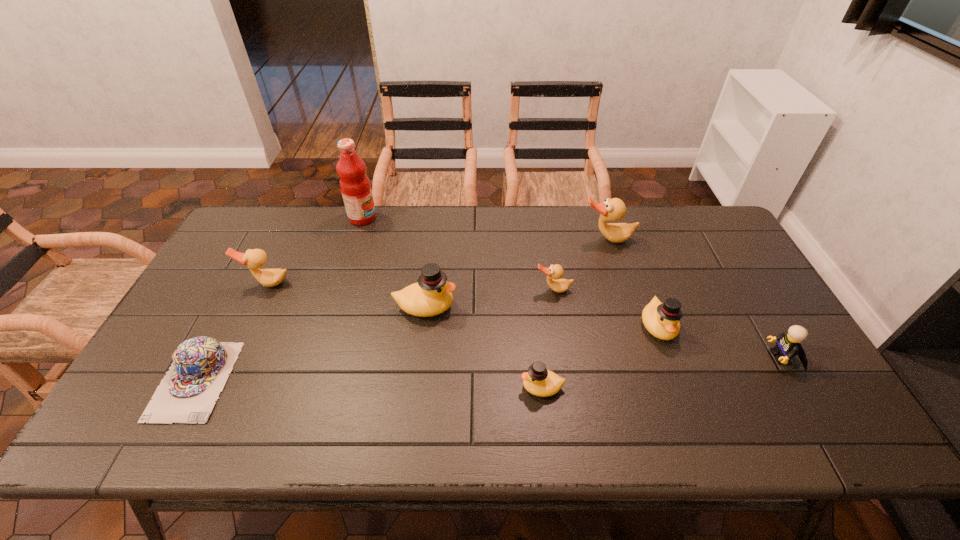
Locate an element on the screen. tan duck object that ranks as the closest to the eighth nearest object is located at coordinates (554, 272).

Identify the location of the closest tan duck to the biggest tan duck. This screenshot has height=540, width=960. (554, 272).

Where is `yellow duck identified as the closest to the second biggest yellow duck`? This screenshot has height=540, width=960. yellow duck identified as the closest to the second biggest yellow duck is located at coordinates (539, 381).

Select which yellow duck appears as the closest to the smallest yellow duck. Please provide its 2D coordinates. Your answer should be formatted as a tuple, i.e. [(x, y)], where the tuple contains the x and y coordinates of a point satisfying the conditions above.

[(432, 295)]

Find the location of a particular element. Image resolution: width=960 pixels, height=540 pixels. blank area in the image that satisfies the following two spatial constraints: 1. on the beak of the smallest tan duck; 2. on the front-facing side of the nearest duck is located at coordinates (569, 387).

The width and height of the screenshot is (960, 540). Identify the location of free space that satisfies the following two spatial constraints: 1. on the beak of the second tan duck from left to right; 2. on the front-facing side of the second yellow duck from left to right. (569, 387).

Identify the location of vacant space that satisfies the following two spatial constraints: 1. on the front-facing side of the biggest yellow duck; 2. on the front, side, and top of the shortest object. (417, 380).

Where is `free region that satisfies the following two spatial constraints: 1. on the front-facing side of the second biggest yellow duck; 2. on the front-facing side of the nearest yellow duck`? The height and width of the screenshot is (540, 960). free region that satisfies the following two spatial constraints: 1. on the front-facing side of the second biggest yellow duck; 2. on the front-facing side of the nearest yellow duck is located at coordinates (680, 387).